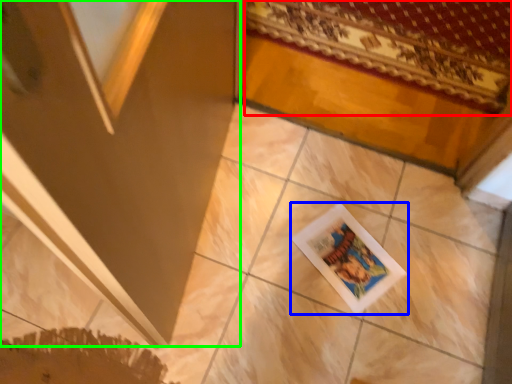
Question: Which object is the farthest from mat (highlighted by a red box)? Choose among these: picture frame (highlighted by a blue box) or screen door (highlighted by a green box).

Choices:
 (A) picture frame
 (B) screen door

Answer: (B)